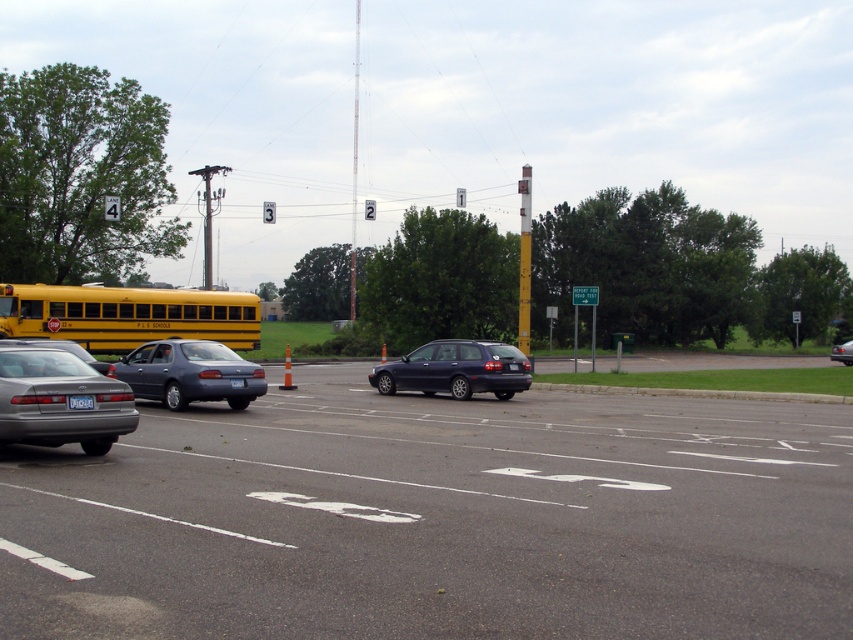
Does metallic silver pole at center have a greater width compared to white plastic license plate at center?

Correct, the width of metallic silver pole at center exceeds that of white plastic license plate at center.

Can you confirm if metallic silver pole at center is positioned to the right of white plastic license plate at center?

Correct, you'll find metallic silver pole at center to the right of white plastic license plate at center.

The width and height of the screenshot is (853, 640). I want to click on metallic silver pole at center, so [524, 259].

You are a GUI agent. You are given a task and a screenshot of the screen. Output one action in this format:
    pyautogui.click(x=<x>, y=<y>)
    Task: Click on the metallic silver pole at center
    The image size is (853, 640).
    Given the screenshot: What is the action you would take?
    pyautogui.click(x=524, y=259)

Is silver metallic sedan at left shorter than metallic silver sedan at center?

Yes.

How far apart are silver metallic sedan at left and metallic silver sedan at center?

silver metallic sedan at left is 37.09 meters away from metallic silver sedan at center.

Is point (3, 342) closer to viewer compared to point (833, 356)?

Yes, it is in front of point (833, 356).

Find the location of a particular element. This screenshot has height=640, width=853. silver metallic sedan at left is located at coordinates (62, 349).

Can you confirm if matte gray sedan at center is shorter than metallic silver pole at center?

Correct, matte gray sedan at center is not as tall as metallic silver pole at center.

Which is in front, point (151, 368) or point (525, 323)?

Positioned in front is point (151, 368).

Image resolution: width=853 pixels, height=640 pixels. I want to click on matte gray sedan at center, so click(x=189, y=372).